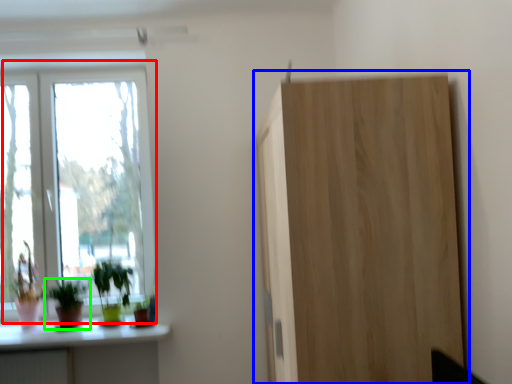
Question: Which object is positioned farthest from window (highlighted by a red box)? Select from cupboard (highlighted by a blue box) and houseplant (highlighted by a green box).

Choices:
 (A) cupboard
 (B) houseplant

Answer: (A)